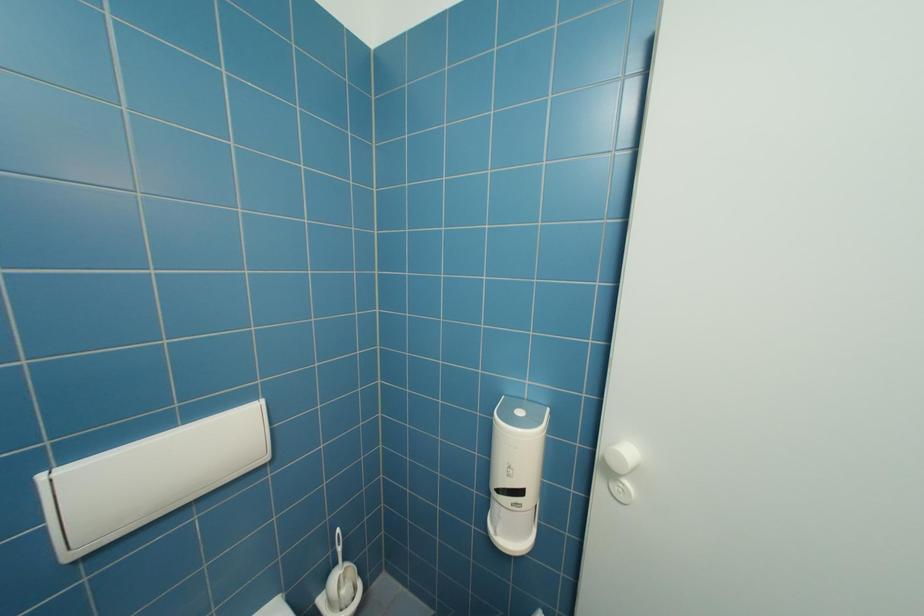
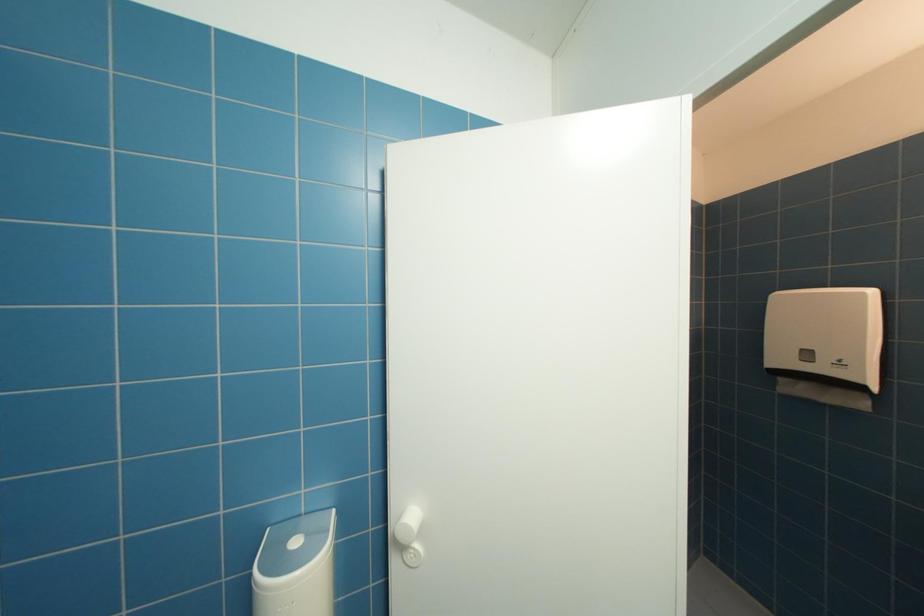
Question: The camera is either moving clockwise (left) or counter-clockwise (right) around the object. The first image is from the beginning of the video and the second image is from the end. Is the camera moving left or right when shooting the video?

Choices:
 (A) Left
 (B) Right

Answer: (A)